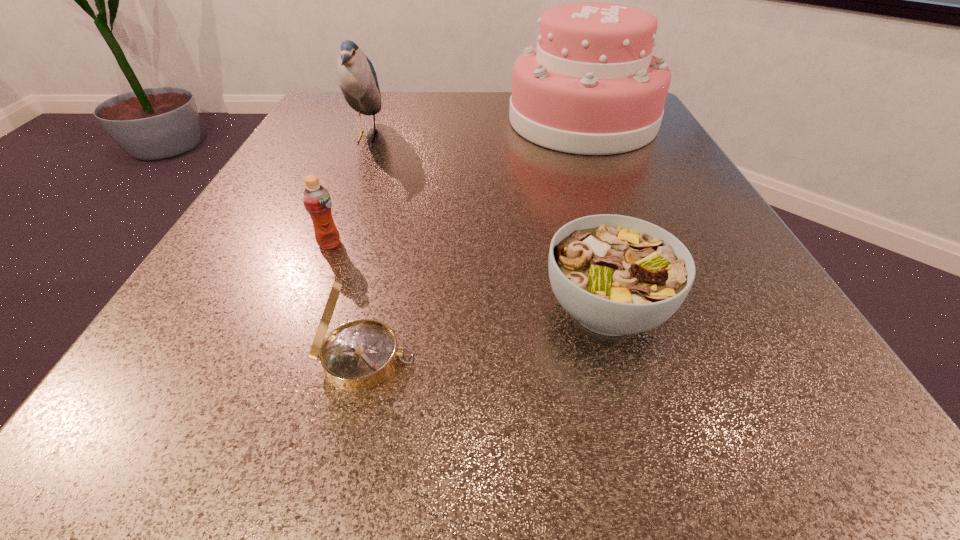
At what (x,y) coordinates should I click in order to perform the action: click on free point that satisfies the following two spatial constraints: 1. at the tip of the orange juice's beak; 2. on the right side of the bird. Please return your answer as a coordinate pair (x, y). The height and width of the screenshot is (540, 960). Looking at the image, I should click on (323, 244).

The image size is (960, 540). In order to click on free spot that satisfies the following two spatial constraints: 1. at the tip of the bird's beak; 2. on the right side of the third farthest object in this screenshot , I will do `click(323, 244)`.

What are the coordinates of `free space in the image that satisfies the following two spatial constraints: 1. on the back side of the birthday cake; 2. on the right side of the shortest object` in the screenshot? It's located at (553, 121).

What are the coordinates of `free space that satisfies the following two spatial constraints: 1. on the back side of the third farthest object; 2. at the tip of the bird's beak` in the screenshot? It's located at (372, 137).